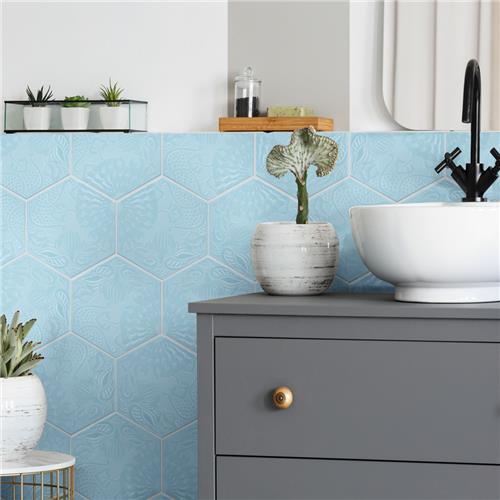
Locate an element on the screen. This screenshot has height=500, width=500. wall is located at coordinates (171, 55), (166, 268).